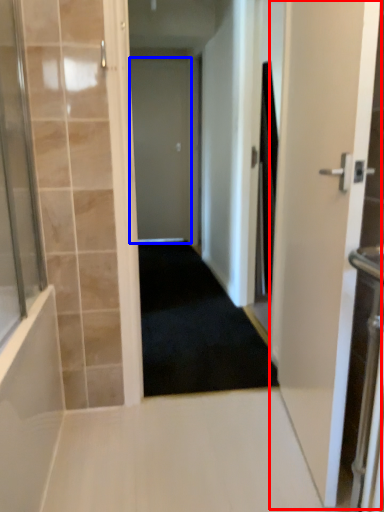
Question: Which object appears farthest to the camera in this image, door (highlighted by a red box) or door (highlighted by a blue box)?

Choices:
 (A) door
 (B) door

Answer: (B)